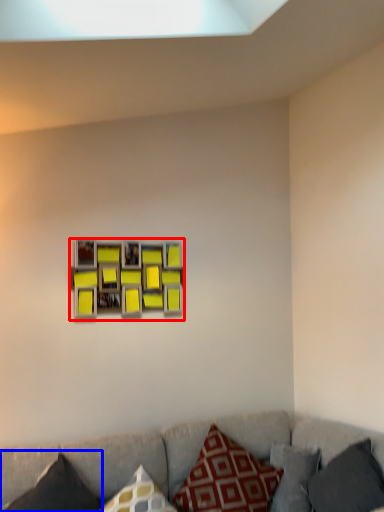
Question: Which point is further to the camera, picture frame (highlighted by a red box) or pillow (highlighted by a blue box)?

Choices:
 (A) picture frame
 (B) pillow

Answer: (A)